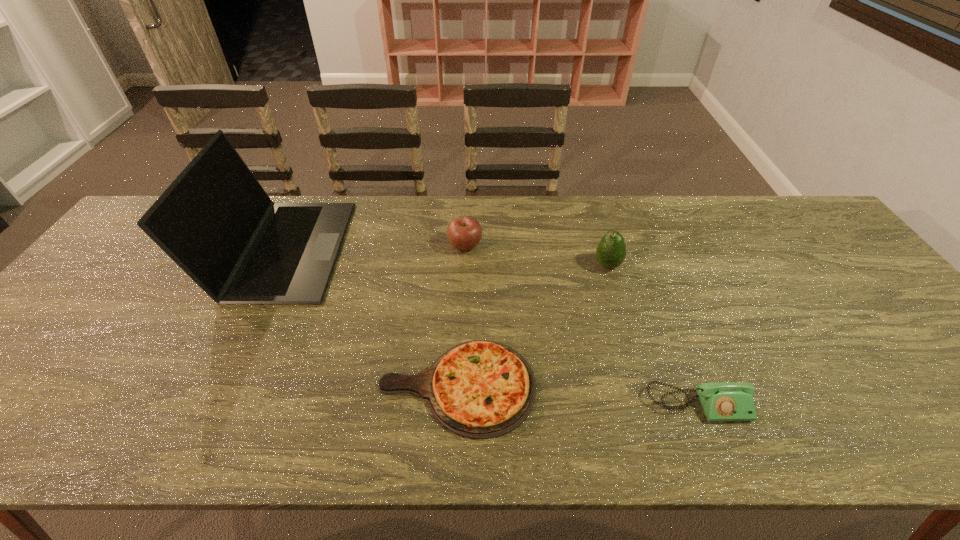
You are a GUI agent. You are given a task and a screenshot of the screen. Output one action in this format:
    pyautogui.click(x=<x>, y=<y>)
    Task: Click on the laptop
    
    Given the screenshot: What is the action you would take?
    pyautogui.click(x=215, y=221)

What are the coordinates of `the leftmost object` in the screenshot? It's located at (215, 221).

Locate an element on the screen. This screenshot has width=960, height=540. the fourth shortest object is located at coordinates (611, 251).

Identify the location of the third tallest object. Image resolution: width=960 pixels, height=540 pixels. (464, 233).

Where is `telephone`? Image resolution: width=960 pixels, height=540 pixels. telephone is located at coordinates (728, 401).

Identify the location of pizza. (480, 389).

You are a GUI agent. You are given a task and a screenshot of the screen. Output one action in this format:
    pyautogui.click(x=<x>, y=<y>)
    Task: Click on the vacant space located 0.140m on the screen of the laptop
    The width and height of the screenshot is (960, 540).
    Given the screenshot: What is the action you would take?
    pyautogui.click(x=389, y=249)

You are a GUI agent. You are given a task and a screenshot of the screen. Output one action in this format:
    pyautogui.click(x=<x>, y=<y>)
    Task: Click on the free space located 0.290m on the back of the avocado
    This screenshot has height=540, width=960.
    Given the screenshot: What is the action you would take?
    pyautogui.click(x=588, y=198)

Where is `vacant space located 0.050m on the side of the apple with the unique marking`? The width and height of the screenshot is (960, 540). vacant space located 0.050m on the side of the apple with the unique marking is located at coordinates (499, 245).

Identify the location of blank space located on the dial of the second shortest object. This screenshot has height=540, width=960. (716, 451).